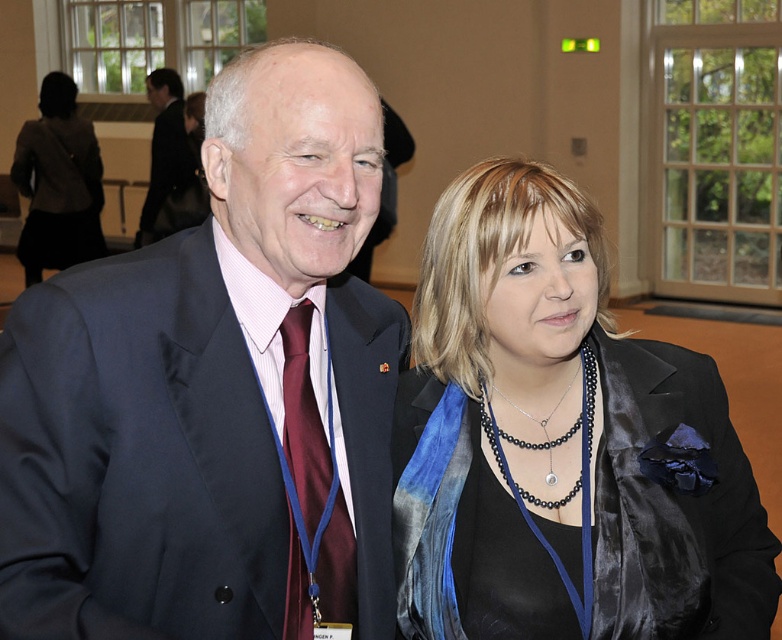
Looking at this image, you are an event planner looking at this image. There is a point at coordinates [214,392] in the image. Based on the scene description, can you identify what object this point is located on?

The point at coordinates [214,392] is on the satin dark blue suit at center.

You are a photographer at an event and need to adjust the camera focus. Which object is positioned lower in the image between the satin dark blue suit at center and the dark gray blazer at left?

The satin dark blue suit at center is positioned lower than the dark gray blazer at left.

You are standing in front of the two people in the image. Which of the two points, point (x=501, y=552) or point (x=296, y=326), is closer to you?

Point (x=501, y=552) is closer to the viewer than point (x=296, y=326).